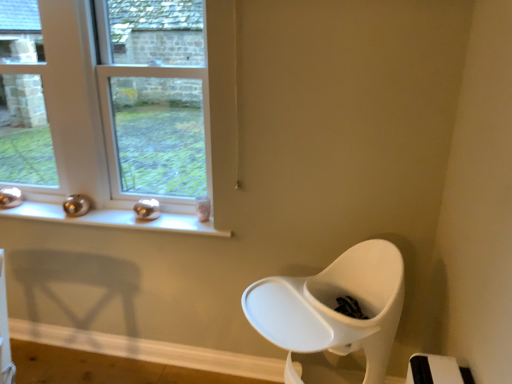
Question: From their relative heights in the image, would you say clear glass window at left, the first window when ordered from left to right, is taller or shorter than clear glass window at upper left, positioned as the 1th window in right-to-left order?

Choices:
 (A) tall
 (B) short

Answer: (A)

Question: Considering the positions of clear glass window at left, the first window when ordered from left to right, and clear glass window at upper left, which is the second window from left to right, in the image, is clear glass window at left, the first window when ordered from left to right, wider or thinner than clear glass window at upper left, which is the second window from left to right,?

Choices:
 (A) thin
 (B) wide

Answer: (A)

Question: Based on their relative distances, which object is nearer to the metallic silver window sill at upper left?

Choices:
 (A) clear glass window at upper left, positioned as the 1th window in right-to-left order
 (B) clear glass window at left, the first window when ordered from left to right

Answer: (A)

Question: Which of these objects is positioned farthest from the clear glass window at upper left, positioned as the 1th window in right-to-left order?

Choices:
 (A) metallic silver window sill at upper left
 (B) clear glass window at left, the first window when ordered from left to right

Answer: (B)